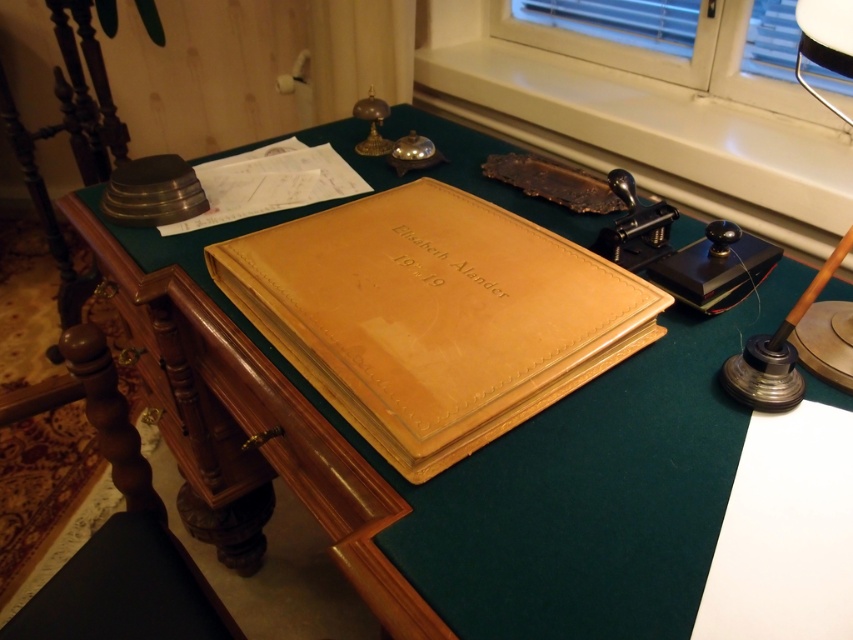
Question: Based on their relative distances, which object is nearer to the matte leather book at center?

Choices:
 (A) brown wood chair at lower left
 (B) wooden table lamp at right

Answer: (B)

Question: Which point is closer to the camera taking this photo?

Choices:
 (A) (416, 394)
 (B) (161, 628)
 (C) (698, 42)
 (D) (799, 17)

Answer: (A)

Question: Can you confirm if white plastic window at upper right is wider than wooden table lamp at right?

Choices:
 (A) yes
 (B) no

Answer: (A)

Question: Which object appears closest to the camera in this image?

Choices:
 (A) wooden table lamp at right
 (B) brown wood chair at lower left
 (C) matte leather book at center

Answer: (A)

Question: Does matte leather book at center appear under wooden table lamp at right?

Choices:
 (A) no
 (B) yes

Answer: (B)

Question: Does brown wood chair at lower left appear under wooden table lamp at right?

Choices:
 (A) yes
 (B) no

Answer: (A)